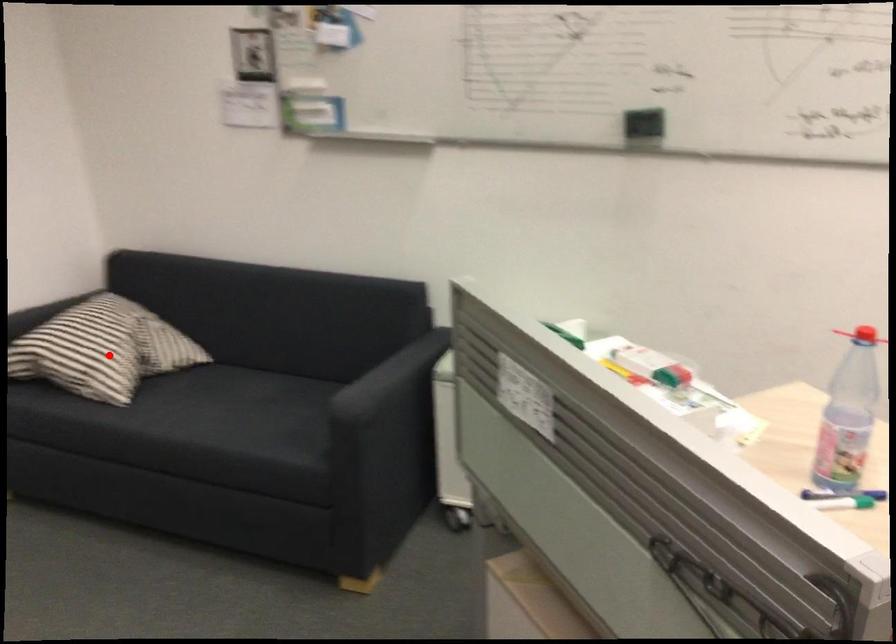
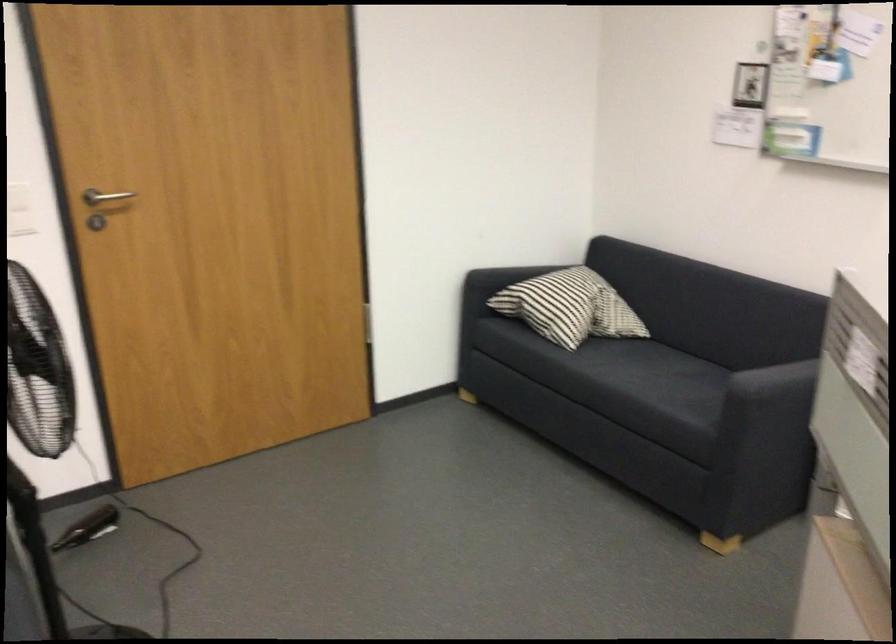
Where in the second image is the point corresponding to the highlighted location from the first image?

(570, 307)